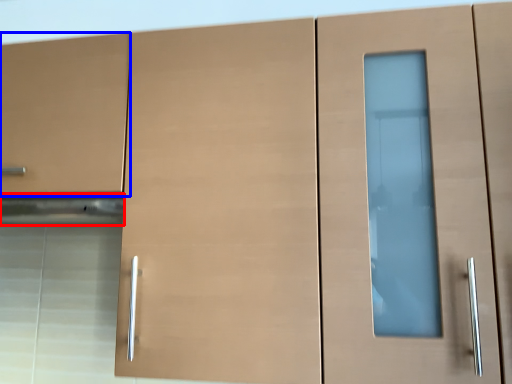
Question: Which of the following is the closest to the observer, exhaust hood (highlighted by a red box) or drawer (highlighted by a blue box)?

Choices:
 (A) exhaust hood
 (B) drawer

Answer: (B)